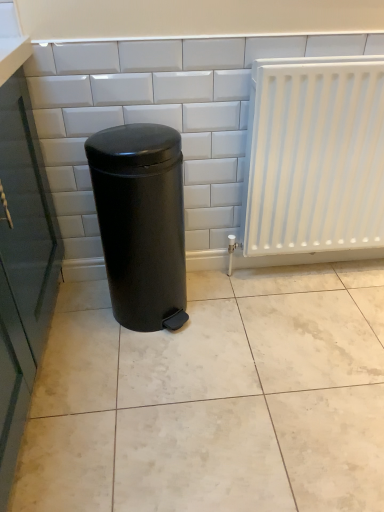
Identify the location of vacant space situated above white glossy tile at center (from a real-world perspective). The width and height of the screenshot is (384, 512). (205, 23).